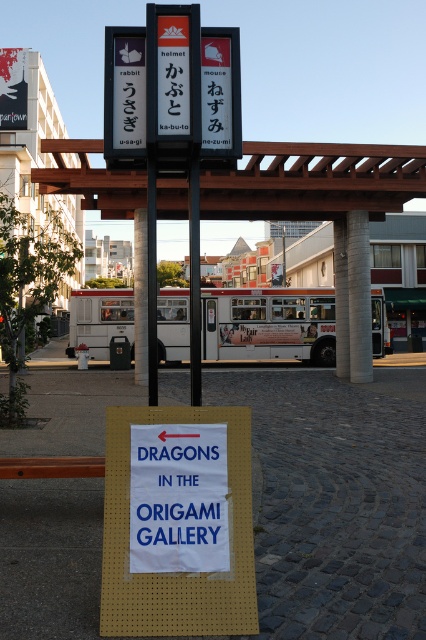
Question: Does white paper sign at center appear under white matte bus at center?

Choices:
 (A) no
 (B) yes

Answer: (B)

Question: Is white matte bus at center to the right of blue paper sign at center from the viewer's perspective?

Choices:
 (A) no
 (B) yes

Answer: (B)

Question: Which point appears closest to the camera in this image?

Choices:
 (A) (307, 314)
 (B) (252, 160)
 (C) (163, 580)
 (D) (134, 518)

Answer: (C)

Question: Estimate the real-world distances between objects in this image. Which object is closer to the wooden signpost at center?

Choices:
 (A) white paper sign at center
 (B) blue paper sign at center
 (C) white matte bus at center

Answer: (B)

Question: Which object is positioned farthest from the wooden signpost at center?

Choices:
 (A) blue paper sign at center
 (B) white matte bus at center
 (C) white paper sign at center

Answer: (C)

Question: Can you confirm if wooden signpost at center is positioned above white matte bus at center?

Choices:
 (A) no
 (B) yes

Answer: (B)